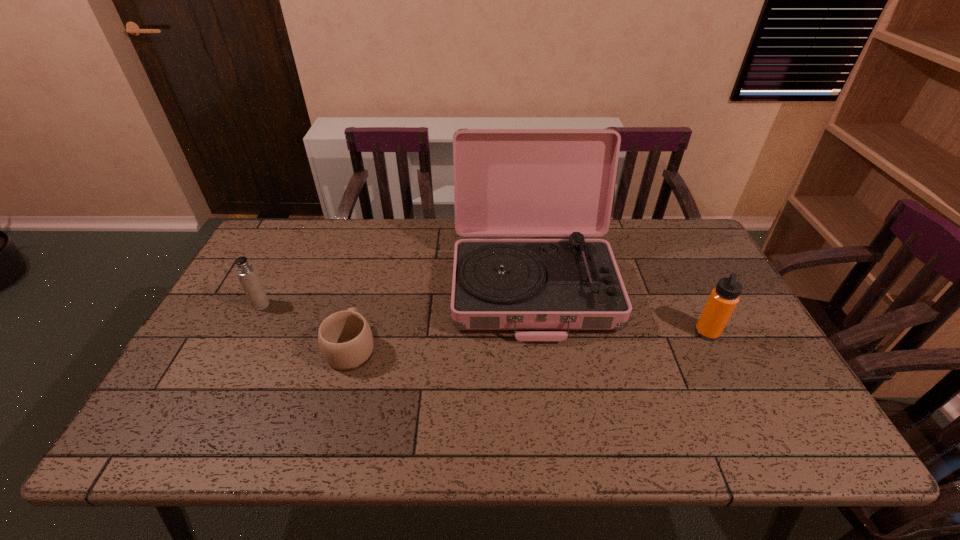
Identify the location of free space located on the back of the left thermos bottle. (283, 261).

Identify the location of vacant area located on the side of the mug with the handle. pos(368,288).

Locate an element on the screen. The width and height of the screenshot is (960, 540). free space located 0.390m on the side of the mug with the handle is located at coordinates (381, 238).

I want to click on vacant region located on the side of the mug with the handle, so pyautogui.click(x=367, y=291).

In order to click on object that is at the far edge in this screenshot , I will do click(507, 182).

Image resolution: width=960 pixels, height=540 pixels. I want to click on object that is at the left edge, so click(245, 271).

Find the location of a particular element. Image resolution: width=960 pixels, height=540 pixels. object that is at the right edge is located at coordinates (724, 298).

The width and height of the screenshot is (960, 540). In the image, there is a desktop. Find the location of `vacant space at the far edge`. vacant space at the far edge is located at coordinates (341, 262).

Locate an element on the screen. The width and height of the screenshot is (960, 540). vacant space at the left edge of the desktop is located at coordinates (184, 388).

Where is `blank area at the right edge`? The width and height of the screenshot is (960, 540). blank area at the right edge is located at coordinates (738, 351).